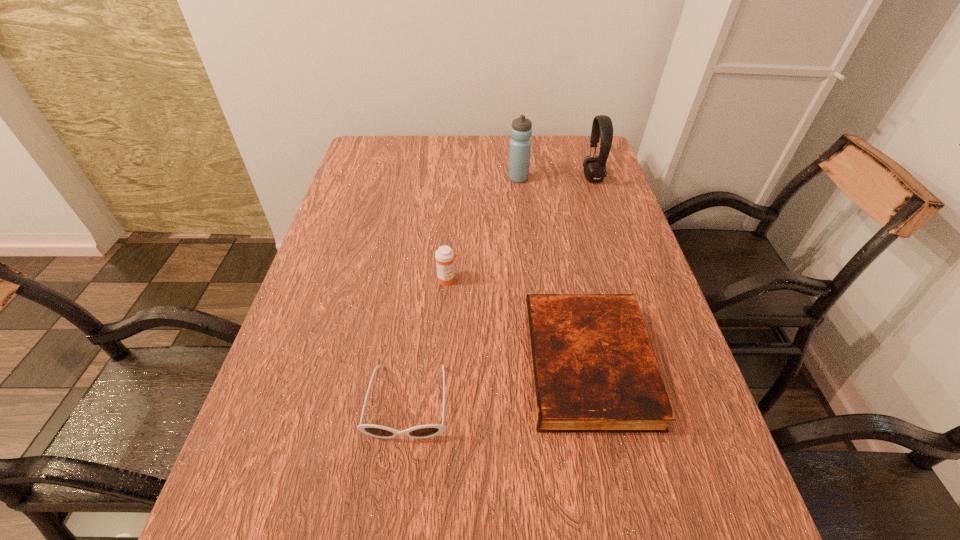
At what (x,y) coordinates should I click in order to perform the action: click on free location located 0.100m on the front of the medicine. Please return your answer as a coordinate pair (x, y). The width and height of the screenshot is (960, 540). Looking at the image, I should click on (444, 319).

You are a GUI agent. You are given a task and a screenshot of the screen. Output one action in this format:
    pyautogui.click(x=<x>, y=<y>)
    Task: Click on the free space located with the lenses of the sunglasses facing outward
    Image resolution: width=960 pixels, height=540 pixels.
    Given the screenshot: What is the action you would take?
    pyautogui.click(x=396, y=496)

Locate an element on the screen. vacant space located on the spine side of the Bible is located at coordinates (343, 364).

You are a GUI agent. You are given a task and a screenshot of the screen. Output one action in this format:
    pyautogui.click(x=<x>, y=<y>)
    Task: Click on the free space located on the spine side of the Bible
    The height and width of the screenshot is (540, 960).
    Given the screenshot: What is the action you would take?
    pyautogui.click(x=412, y=364)

Where is `free location located on the spine side of the Bible`? free location located on the spine side of the Bible is located at coordinates (358, 364).

I want to click on object that is at the far edge, so click(x=602, y=128).

I want to click on headset that is positioned at the right edge, so click(x=602, y=128).

What are the coordinates of `Bible located in the right edge section of the desktop` in the screenshot? It's located at (593, 370).

Where is `object present at the far right corner`? The image size is (960, 540). object present at the far right corner is located at coordinates (602, 128).

In the image, there is a desktop. What are the coordinates of `vacant space at the far edge` in the screenshot? It's located at (555, 171).